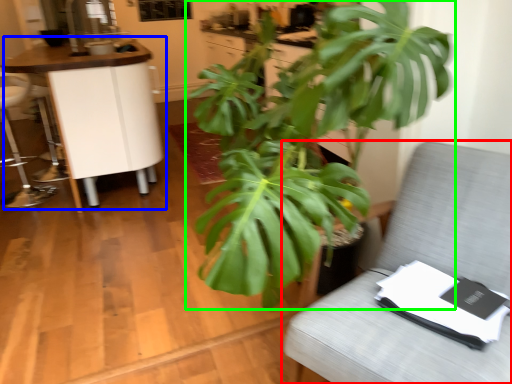
Question: Estimate the real-world distances between objects in this image. Which object is farther from furniture (highlighted by a red box), table (highlighted by a blue box) or houseplant (highlighted by a green box)?

Choices:
 (A) table
 (B) houseplant

Answer: (A)